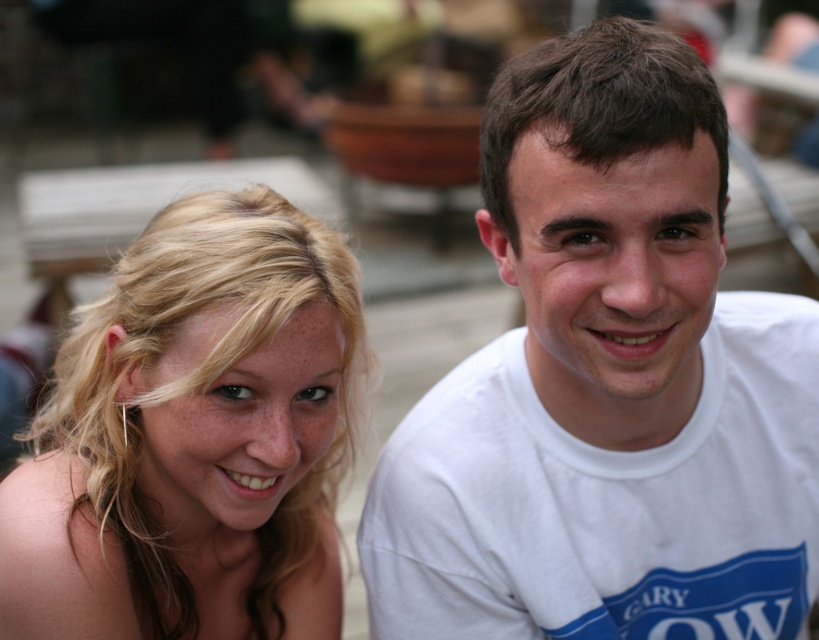
Does white cotton t-shirt at upper right have a greater height compared to blonde hair at left?

Indeed, white cotton t-shirt at upper right has a greater height compared to blonde hair at left.

Is white cotton t-shirt at upper right smaller than blonde hair at left?

No, white cotton t-shirt at upper right is not smaller than blonde hair at left.

At what (x,y) coordinates should I click in order to perform the action: click on white cotton t-shirt at upper right. Please return your answer as a coordinate pair (x, y). The image size is (819, 640). Looking at the image, I should click on (607, 385).